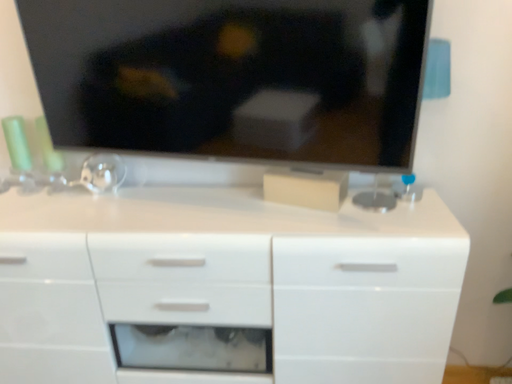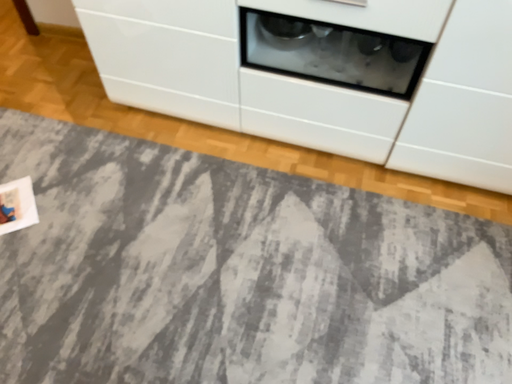
Question: Which way did the camera rotate in the video?

Choices:
 (A) rotated left
 (B) rotated right

Answer: (A)